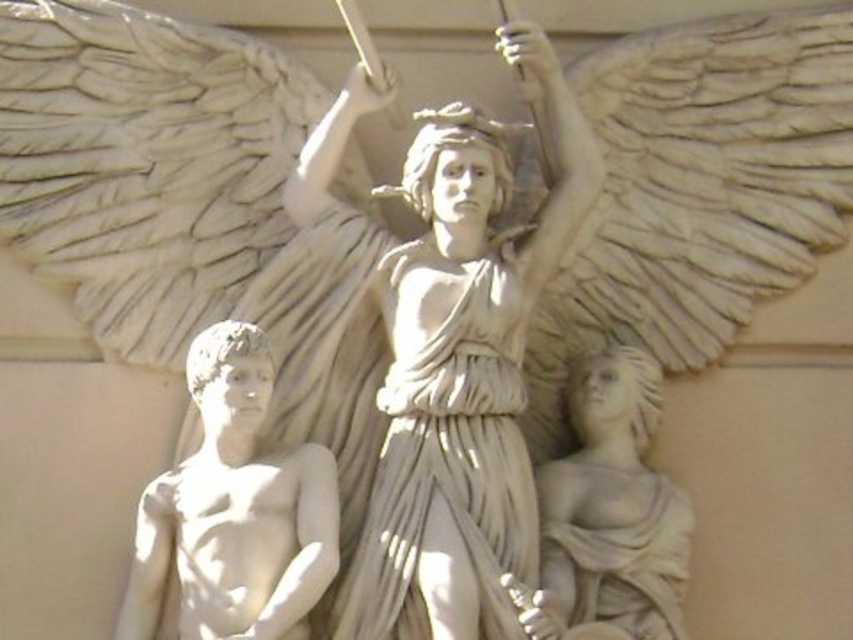
Is point (535, 84) less distant than point (228, 365)?

No, it is not.

Is point (454, 412) positioned after point (241, 552)?

Yes.

What are the coordinates of `white marble statue at center` in the screenshot? It's located at (463, 368).

Looking at this image, can you confirm if white marble statue at center is bigger than white marble statue at lower right?

Indeed, white marble statue at center has a larger size compared to white marble statue at lower right.

Measure the distance between white marble statue at center and white marble statue at lower right.

7.21 meters

Who is more forward, (534, 227) or (660, 560)?

Point (660, 560) is more forward.

At what (x,y) coordinates should I click in order to perform the action: click on white marble statue at center. Please return your answer as a coordinate pair (x, y). The image size is (853, 640). Looking at the image, I should click on (463, 368).

Which is behind, point (138, 600) or point (653, 509)?

The point (653, 509) is behind.

Is white marble statue at lower left to the left of white marble statue at lower right from the viewer's perspective?

Indeed, white marble statue at lower left is positioned on the left side of white marble statue at lower right.

Find the location of a particular element. This screenshot has height=640, width=853. white marble statue at lower left is located at coordinates (234, 509).